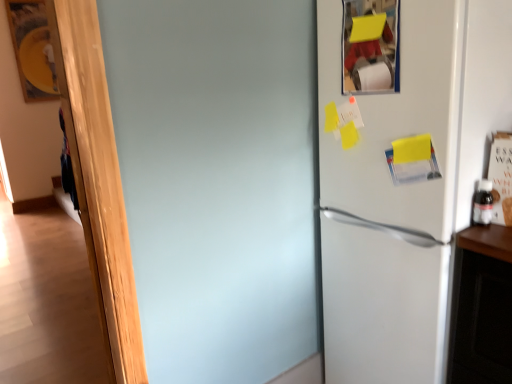
Where is `white matte refrigerator at right`? The height and width of the screenshot is (384, 512). white matte refrigerator at right is located at coordinates (404, 182).

The image size is (512, 384). Describe the element at coordinates (404, 182) in the screenshot. I see `white matte refrigerator at right` at that location.

The width and height of the screenshot is (512, 384). In order to click on transparent plastic bottle at right in this screenshot , I will do `click(482, 203)`.

What do you see at coordinates (482, 203) in the screenshot? I see `transparent plastic bottle at right` at bounding box center [482, 203].

What is the approximate width of transparent plastic bottle at right?

3.13 inches.

I want to click on white matte refrigerator at right, so click(x=404, y=182).

Can you confirm if transparent plastic bottle at right is positioned to the right of white matte refrigerator at right?

Yes, transparent plastic bottle at right is to the right of white matte refrigerator at right.

Is transparent plastic bottle at right positioned in front of white matte refrigerator at right?

No, it is behind white matte refrigerator at right.

Considering the points (475, 206) and (395, 150), which point is in front, point (475, 206) or point (395, 150)?

Positioned in front is point (475, 206).

From the image's perspective, is transparent plastic bottle at right under white matte refrigerator at right?

No, from the image's perspective, transparent plastic bottle at right is not below white matte refrigerator at right.

From a real-world perspective, is transparent plastic bottle at right physically below white matte refrigerator at right?

No.

Can you confirm if transparent plastic bottle at right is wider than white matte refrigerator at right?

No, transparent plastic bottle at right is not wider than white matte refrigerator at right.

Between transparent plastic bottle at right and white matte refrigerator at right, which one has more height?

With more height is white matte refrigerator at right.

Does transparent plastic bottle at right have a smaller size compared to white matte refrigerator at right?

Yes, transparent plastic bottle at right is smaller than white matte refrigerator at right.

Is white matte refrigerator at right surrounded by transparent plastic bottle at right?

No, white matte refrigerator at right is not a part of transparent plastic bottle at right.

Is transparent plastic bottle at right not near white matte refrigerator at right?

No, transparent plastic bottle at right is in close proximity to white matte refrigerator at right.

Is transparent plastic bottle at right aimed at white matte refrigerator at right?

No, transparent plastic bottle at right is not turned towards white matte refrigerator at right.

Find the location of a particular element. The width and height of the screenshot is (512, 384). bottle behind the white matte refrigerator at right is located at coordinates [482, 203].

Visually, is white matte refrigerator at right positioned to the left or to the right of transparent plastic bottle at right?

Based on their positions, white matte refrigerator at right is located to the left of transparent plastic bottle at right.

Does white matte refrigerator at right lie behind transparent plastic bottle at right?

No, the depth of white matte refrigerator at right is less than that of transparent plastic bottle at right.

Which is behind, point (365, 374) or point (481, 186)?

Positioned behind is point (365, 374).

From the image's perspective, would you say white matte refrigerator at right is positioned over transparent plastic bottle at right?

No, from the image's perspective, white matte refrigerator at right is not on top of transparent plastic bottle at right.

From a real-world perspective, is white matte refrigerator at right positioned under transparent plastic bottle at right based on gravity?

Indeed, from a real-world perspective, white matte refrigerator at right is positioned beneath transparent plastic bottle at right.

Considering the sizes of objects white matte refrigerator at right and transparent plastic bottle at right in the image provided, who is wider, white matte refrigerator at right or transparent plastic bottle at right?

Wider between the two is white matte refrigerator at right.

Is white matte refrigerator at right shorter than transparent plastic bottle at right?

No, white matte refrigerator at right is not shorter than transparent plastic bottle at right.

Based on their sizes in the image, would you say white matte refrigerator at right is bigger or smaller than transparent plastic bottle at right?

Clearly, white matte refrigerator at right is larger in size than transparent plastic bottle at right.

Is transparent plastic bottle at right a part of white matte refrigerator at right?

No, transparent plastic bottle at right is not inside white matte refrigerator at right.

Is white matte refrigerator at right in contact with transparent plastic bottle at right?

No, white matte refrigerator at right is not beside transparent plastic bottle at right.

Is white matte refrigerator at right facing towards transparent plastic bottle at right?

No, white matte refrigerator at right is not turned towards transparent plastic bottle at right.

This screenshot has height=384, width=512. I want to click on refrigerator lying below the transparent plastic bottle at right (from the image's perspective), so click(404, 182).

Where is `bottle on the right of white matte refrigerator at right`? The image size is (512, 384). bottle on the right of white matte refrigerator at right is located at coordinates (482, 203).

Locate an element on the screen. The image size is (512, 384). bottle above the white matte refrigerator at right (from the image's perspective) is located at coordinates (482, 203).